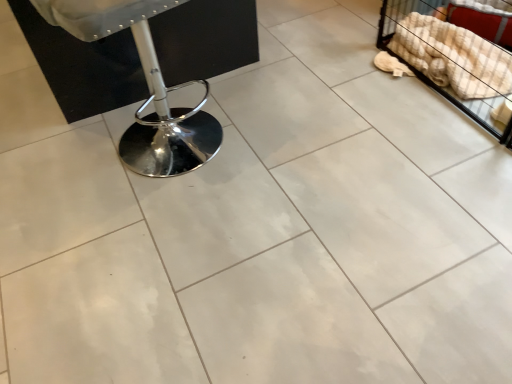
The width and height of the screenshot is (512, 384). Find the location of `free space to the left of chrome metallic swivel chair at left`. free space to the left of chrome metallic swivel chair at left is located at coordinates (61, 162).